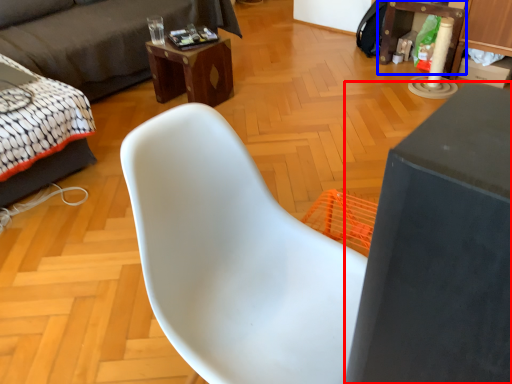
Question: Among these objects, which one is farthest to the camera, table (highlighted by a red box) or table (highlighted by a blue box)?

Choices:
 (A) table
 (B) table

Answer: (B)